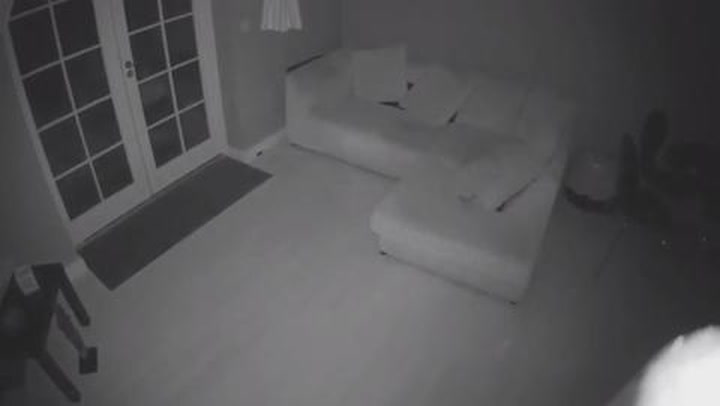
The height and width of the screenshot is (406, 720). In order to click on door handle in this screenshot , I will do `click(127, 75)`.